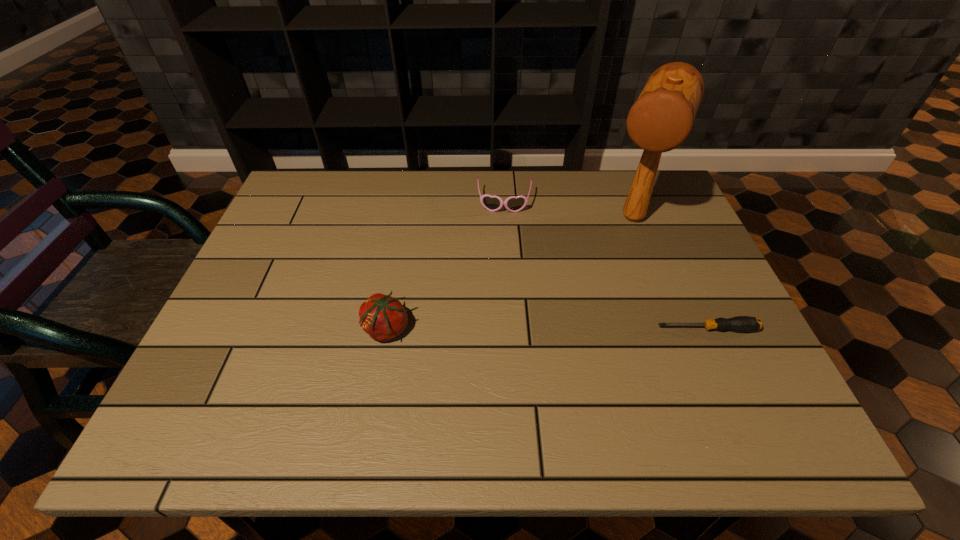
At what (x,y) coordinates should I click in order to perform the action: click on tomato. Please return your answer as a coordinate pair (x, y). The height and width of the screenshot is (540, 960). Looking at the image, I should click on (383, 317).

Where is `the leftmost object`? This screenshot has height=540, width=960. the leftmost object is located at coordinates (383, 317).

This screenshot has width=960, height=540. What are the coordinates of `the shortest object` in the screenshot? It's located at (739, 323).

Find the location of a particular element. the tallest object is located at coordinates [661, 119].

You are a GUI agent. You are given a task and a screenshot of the screen. Output one action in this format:
    pyautogui.click(x=<x>, y=<y>)
    Task: Click on the third tallest object
    The image size is (960, 540).
    Given the screenshot: What is the action you would take?
    pyautogui.click(x=492, y=203)

Locate an element on the screen. sunglasses is located at coordinates (492, 203).

Where is `vacant region located on the front-facing side of the leftmost object`? The height and width of the screenshot is (540, 960). vacant region located on the front-facing side of the leftmost object is located at coordinates click(x=272, y=329).

I want to click on free location located on the front-facing side of the leftmost object, so click(x=276, y=329).

You are a GUI agent. You are given a task and a screenshot of the screen. Output one action in this format:
    pyautogui.click(x=<x>, y=<y>)
    Task: Click on the vacant space located 0.190m on the front-facing side of the leftmost object
    This screenshot has height=540, width=960.
    Given the screenshot: What is the action you would take?
    pyautogui.click(x=276, y=329)

This screenshot has width=960, height=540. I want to click on free spot located 0.050m on the strike surface of the mallet, so click(620, 254).